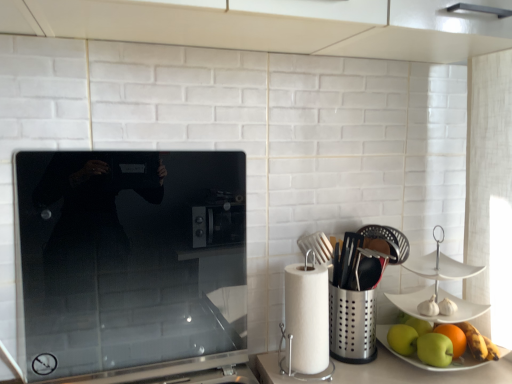
Question: In terms of width, does green matte apple at lower right, which ranks as the third apple in right-to-left order, look wider or thinner when compared to smooth glass cooktop at center?

Choices:
 (A) thin
 (B) wide

Answer: (B)

Question: Is green matte apple at lower right, which ranks as the third apple in right-to-left order, in front of or behind smooth glass cooktop at center in the image?

Choices:
 (A) behind
 (B) front

Answer: (A)

Question: Which is farther from the green matte apple at lower right, arranged as the second apple when viewed from the right?

Choices:
 (A) orange matte at right
 (B) smooth glass cooktop at center
 (C) green matte apple at lower right, which ranks as the third apple in right-to-left order
 (D) green matte apple at lower right, which is counted as the 3th apple, starting from the left
 (E) white paper towel at right

Answer: (B)

Question: Based on their relative distances, which object is farther from the smooth glass cooktop at center?

Choices:
 (A) white paper towel at right
 (B) green matte apple at lower right, which is counted as the 3th apple, starting from the left
 (C) green matte apple at lower right, acting as the second apple starting from the left
 (D) orange matte at right
 (E) green matte apple at lower right, the 1th apple from the left

Answer: (D)